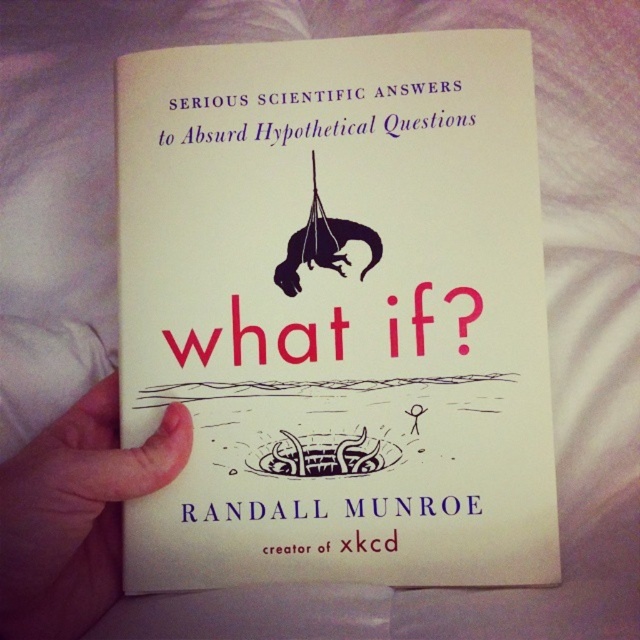
Question: Can you confirm if white paper book at center is positioned below white skin at lower left?

Choices:
 (A) no
 (B) yes

Answer: (A)

Question: Which point is closer to the camera taking this photo?

Choices:
 (A) (64, 588)
 (B) (131, 273)

Answer: (A)

Question: Is white paper book at center smaller than white skin at lower left?

Choices:
 (A) no
 (B) yes

Answer: (B)

Question: In this image, where is white paper book at center located relative to white skin at lower left?

Choices:
 (A) below
 (B) above

Answer: (B)

Question: Which point is closer to the camera?

Choices:
 (A) white paper book at center
 (B) white skin at lower left

Answer: (B)

Question: Which of the following is the farthest from the observer?

Choices:
 (A) (188, 196)
 (B) (45, 563)

Answer: (A)